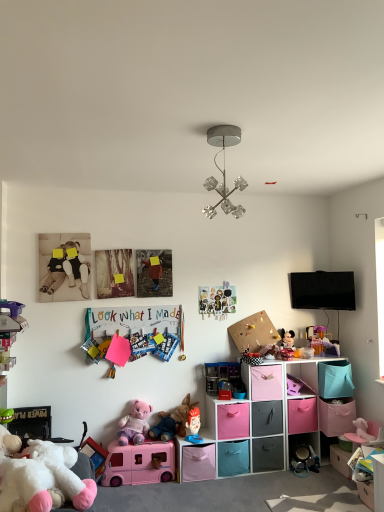
Where is `empty space that is in between pink fabric storage box at lower center, arranged as the 2th storage box when ordered from the bottom, and matte pink plastic van at lower center, which ranks as the 3th toy in front-to-back order`? Image resolution: width=384 pixels, height=512 pixels. empty space that is in between pink fabric storage box at lower center, arranged as the 2th storage box when ordered from the bottom, and matte pink plastic van at lower center, which ranks as the 3th toy in front-to-back order is located at coordinates (155, 486).